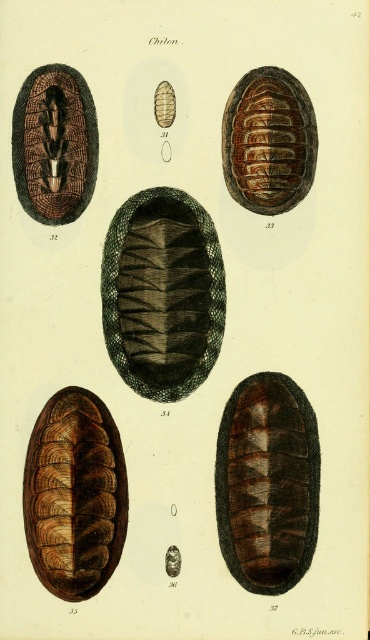
Based on the photo, how distant is shiny brown shell at center from brown textured snail at upper left?

shiny brown shell at center is 26.39 inches from brown textured snail at upper left.

Is shiny brown shell at center taller than brown textured snail at upper left?

Correct, shiny brown shell at center is much taller as brown textured snail at upper left.

Between point (251, 385) and point (45, 76), which one is positioned in front?

Point (45, 76) is in front.

This screenshot has width=370, height=640. I want to click on shiny brown shell at center, so click(267, 483).

Which is above, brown textured snail at lower left or brown textured pill at upper center?

brown textured pill at upper center is above.

Is brown textured snail at lower left further to the viewer compared to brown textured pill at upper center?

No.

Does point (62, 401) come behind point (167, 88)?

Yes, it is.

You are a GUI agent. You are given a task and a screenshot of the screen. Output one action in this format:
    pyautogui.click(x=<x>, y=<y>)
    Task: Click on the brown textured snail at lower left
    This screenshot has height=640, width=370.
    Given the screenshot: What is the action you would take?
    pyautogui.click(x=75, y=493)

Between shiny brown shell at center and brown textured snail at lower left, which one appears on the right side from the viewer's perspective?

Positioned to the right is shiny brown shell at center.

Which is below, shiny brown shell at center or brown textured snail at lower left?

brown textured snail at lower left is lower down.

Which is in front, point (227, 525) or point (54, 429)?

Point (227, 525) is more forward.

Image resolution: width=370 pixels, height=640 pixels. I want to click on shiny brown shell at center, so click(x=267, y=483).